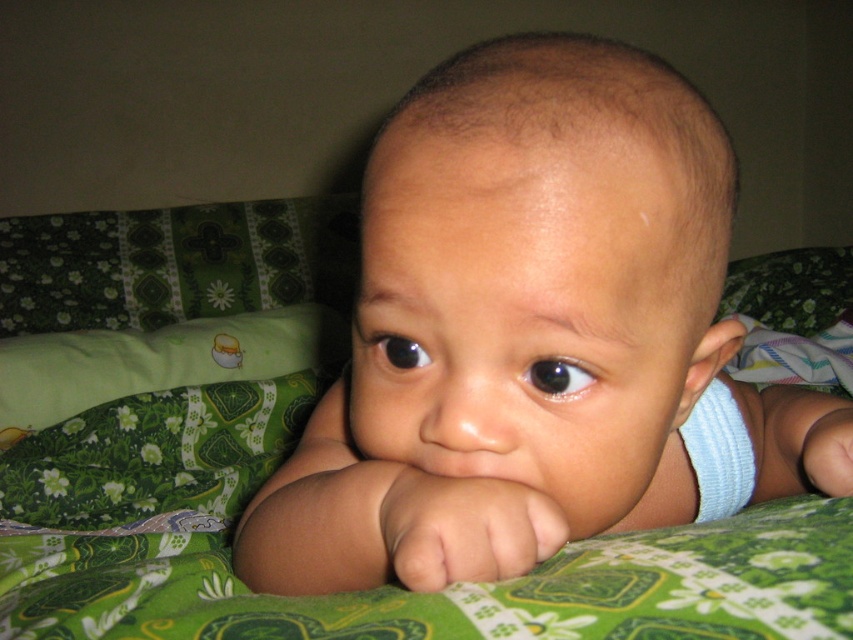
Question: Does smooth skin baby at center have a smaller size compared to green fabric pillow at center?

Choices:
 (A) no
 (B) yes

Answer: (B)

Question: From the image, what is the correct spatial relationship of smooth skin baby at center in relation to green fabric pillow at center?

Choices:
 (A) below
 (B) above

Answer: (B)

Question: Which of the following is the farthest from the observer?

Choices:
 (A) green fabric pillow at center
 (B) smooth skin baby at center

Answer: (A)

Question: Which of the following is the farthest from the observer?

Choices:
 (A) (376, 218)
 (B) (238, 321)

Answer: (B)

Question: Is the position of smooth skin baby at center more distant than that of green fabric pillow at center?

Choices:
 (A) no
 (B) yes

Answer: (A)

Question: Which of the following is the farthest from the observer?

Choices:
 (A) pyautogui.click(x=657, y=428)
 (B) pyautogui.click(x=163, y=346)

Answer: (B)